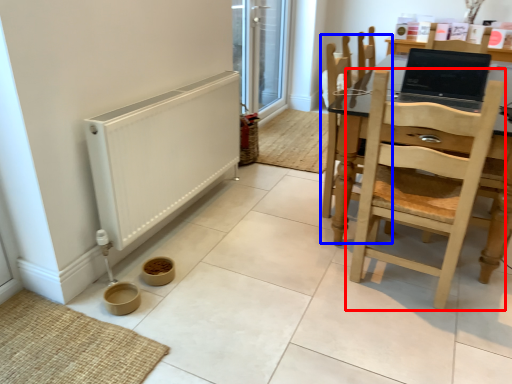
Question: Which object appears closest to the camera in this image, chair (highlighted by a red box) or chair (highlighted by a blue box)?

Choices:
 (A) chair
 (B) chair

Answer: (A)